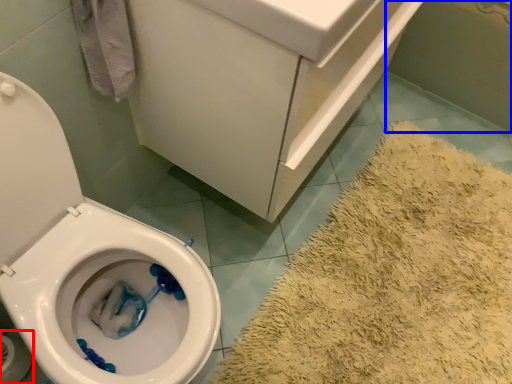
Question: Which object is closer to the camera taking this photo, toilet paper (highlighted by a red box) or bath (highlighted by a blue box)?

Choices:
 (A) toilet paper
 (B) bath

Answer: (A)